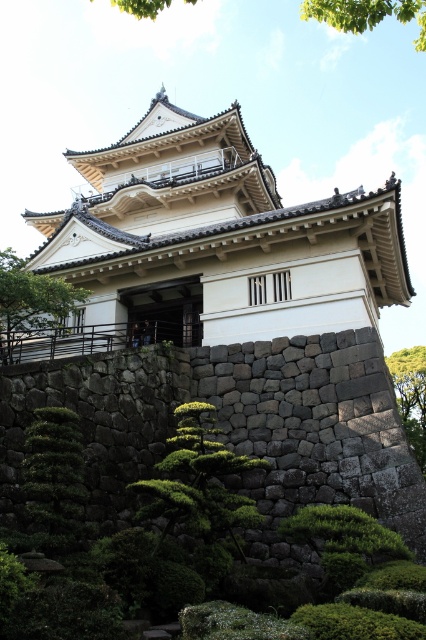
Question: Which object is the closest to the green leafy tree at left?

Choices:
 (A) green leafy bush at lower center
 (B) green leafy tree at upper center

Answer: (A)

Question: Which object appears farthest from the camera in this image?

Choices:
 (A) green leafy tree at center-right
 (B) green mossy bush at lower center
 (C) green leafy bush at lower left
 (D) green leafy tree at upper center

Answer: (A)

Question: Does green leafy bush at lower center come behind green mossy bush at lower center?

Choices:
 (A) no
 (B) yes

Answer: (B)

Question: Is green mossy bush at lower center above green leafy tree at upper center?

Choices:
 (A) no
 (B) yes

Answer: (A)

Question: In this image, where is green leafy bush at lower center located relative to green leafy tree at center-right?

Choices:
 (A) left
 (B) right

Answer: (A)

Question: Which point appears farthest from the camera in this image?

Choices:
 (A) (69, 538)
 (B) (302, 541)
 (C) (57, 304)
 (D) (417, 356)

Answer: (D)